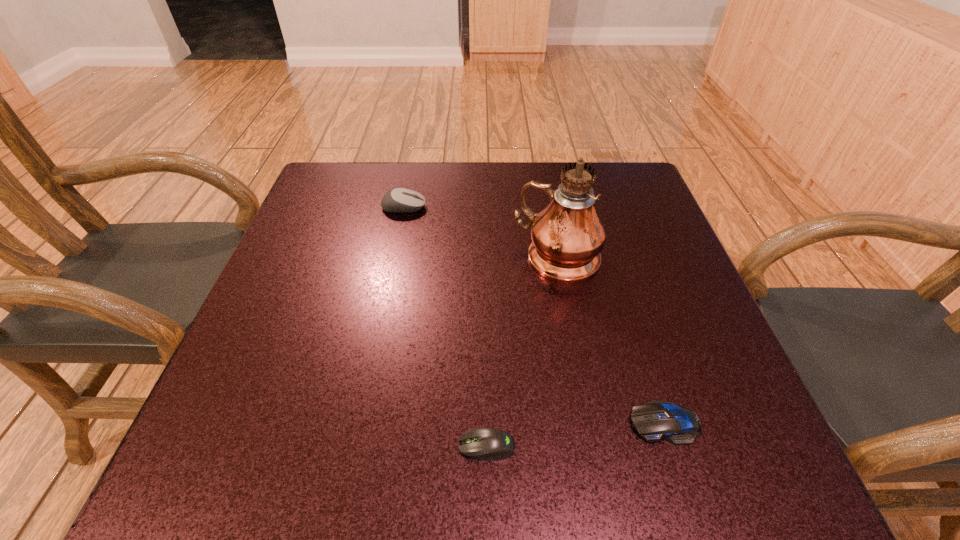
You are a GUI agent. You are given a task and a screenshot of the screen. Output one action in this format:
    pyautogui.click(x=<x>, y=<y>)
    Task: Click on the free point that satisfies the following two spatial constraints: 1. on the wheel side of the leftmost object; 2. on the left side of the third nearest object
    The height and width of the screenshot is (540, 960).
    Given the screenshot: What is the action you would take?
    pyautogui.click(x=394, y=258)

Find the location of a particular element. vacant region that satisfies the following two spatial constraints: 1. on the wheel side of the tallest computer mouse; 2. on the back side of the third nearest object is located at coordinates (394, 258).